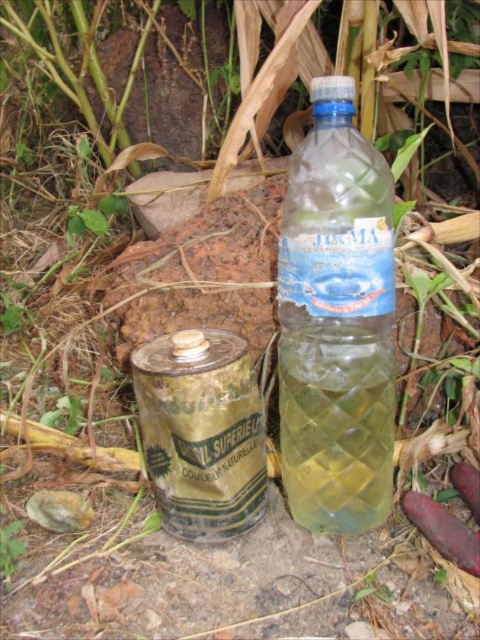
Question: Is clear plastic bottle at center positioned behind green metallic can at center?

Choices:
 (A) yes
 (B) no

Answer: (B)

Question: Which of the following is the farthest from the observer?

Choices:
 (A) (244, 417)
 (B) (350, 131)

Answer: (A)

Question: Does clear plastic bottle at center have a lesser width compared to green metallic can at center?

Choices:
 (A) yes
 (B) no

Answer: (A)

Question: Can you confirm if clear plastic bottle at center is positioned to the right of green metallic can at center?

Choices:
 (A) no
 (B) yes

Answer: (B)